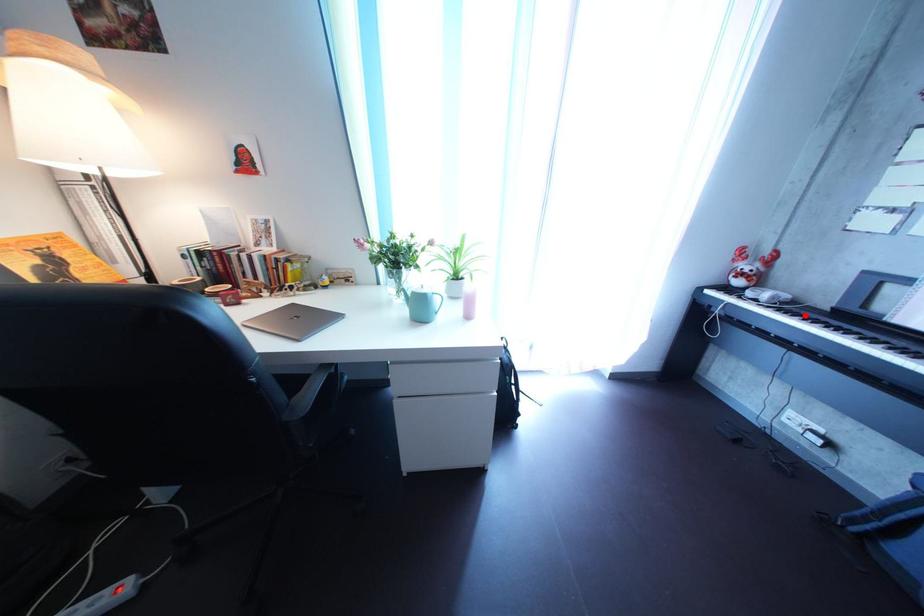
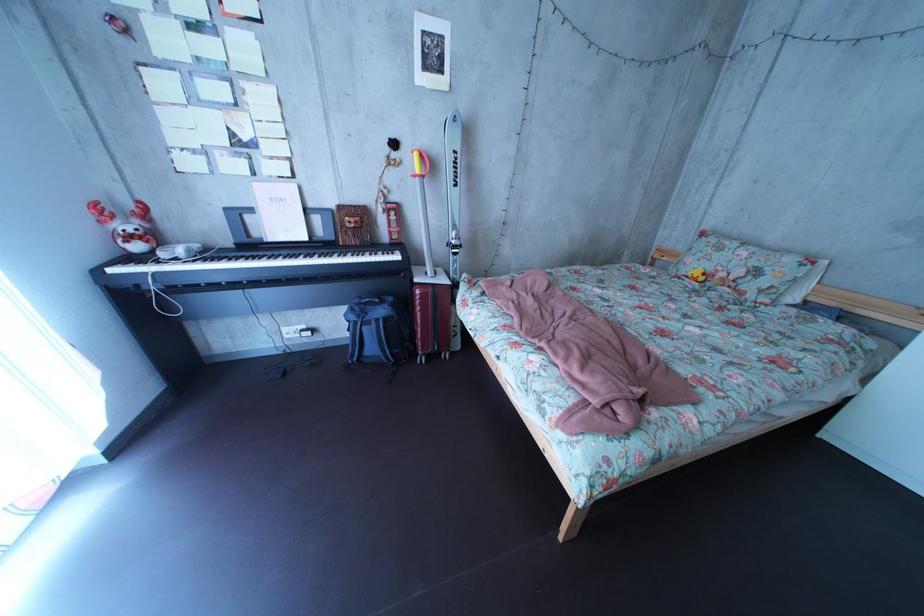
Find the pixel in the second image that matches the highlighted location in the first image.

(225, 262)